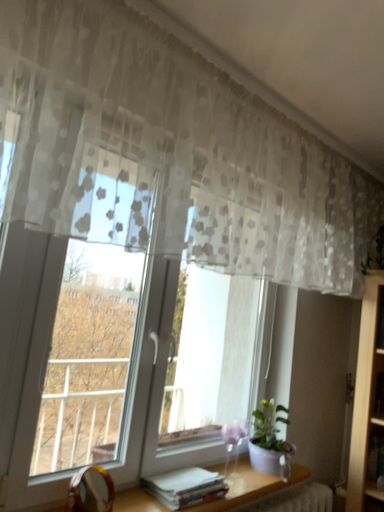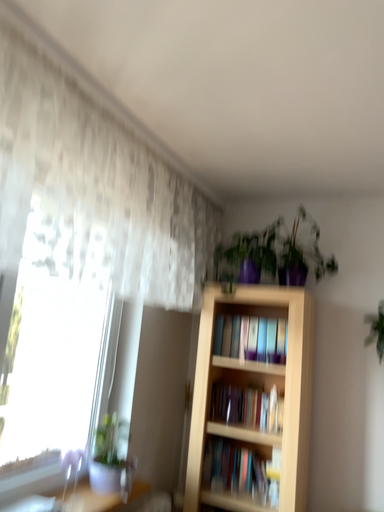
Question: Which way did the camera rotate in the video?

Choices:
 (A) rotated right
 (B) rotated left

Answer: (A)